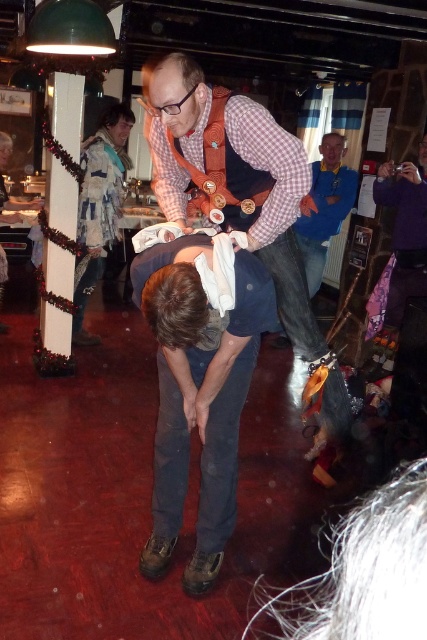
Can you confirm if checkered fabric shirt at center is smaller than blue cotton shirt at center?

No.

Between point (280, 150) and point (318, 163), which one is positioned in front?

Positioned in front is point (280, 150).

Where is `checkered fabric shirt at center`? This screenshot has height=640, width=427. checkered fabric shirt at center is located at coordinates (240, 196).